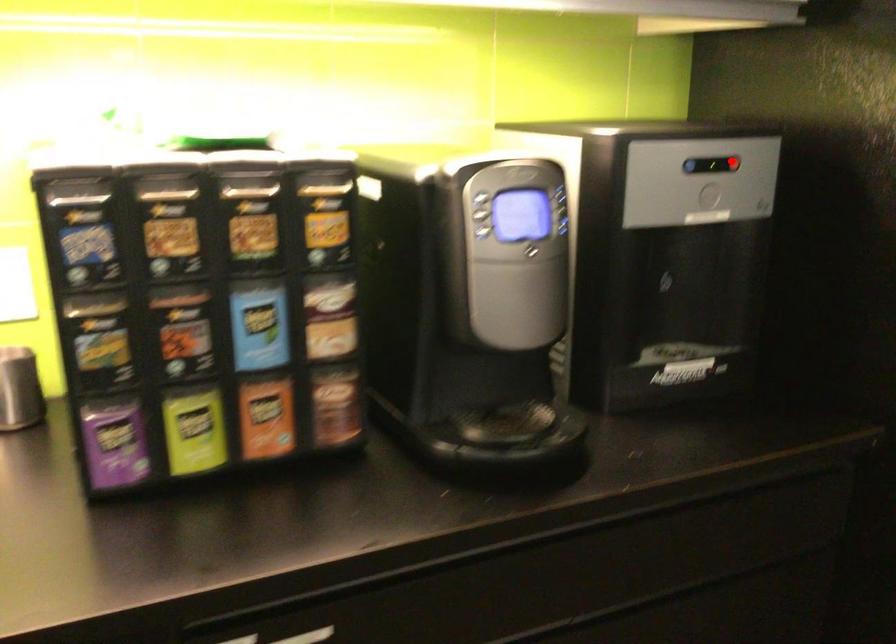
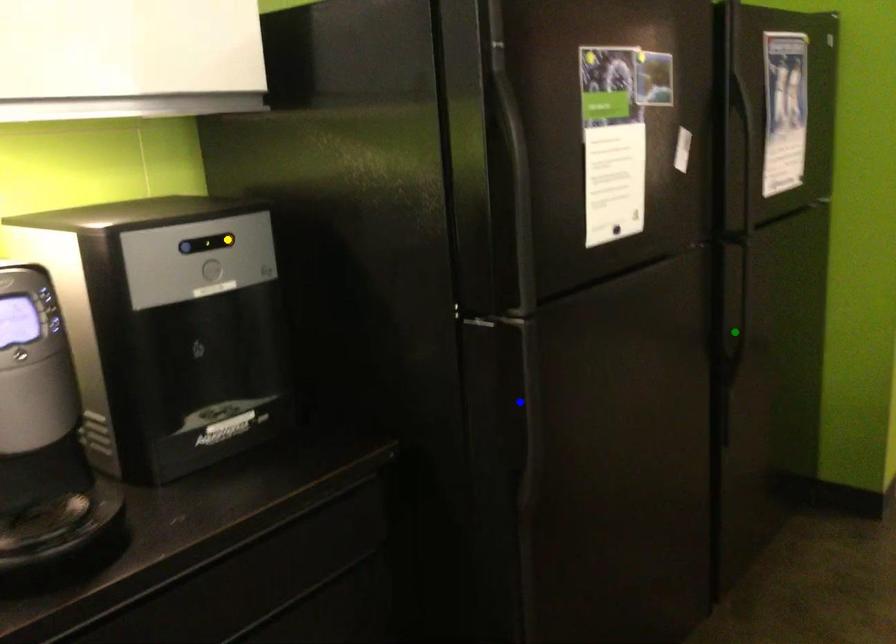
Question: I am providing you with two images of the same scene from different viewpoints. A red point is marked on the first image. You are given multiple points on the second image. Which point in image 2 represents the same 3d spot as the red point in image 1?

Choices:
 (A) green point
 (B) blue point
 (C) yellow point

Answer: (C)